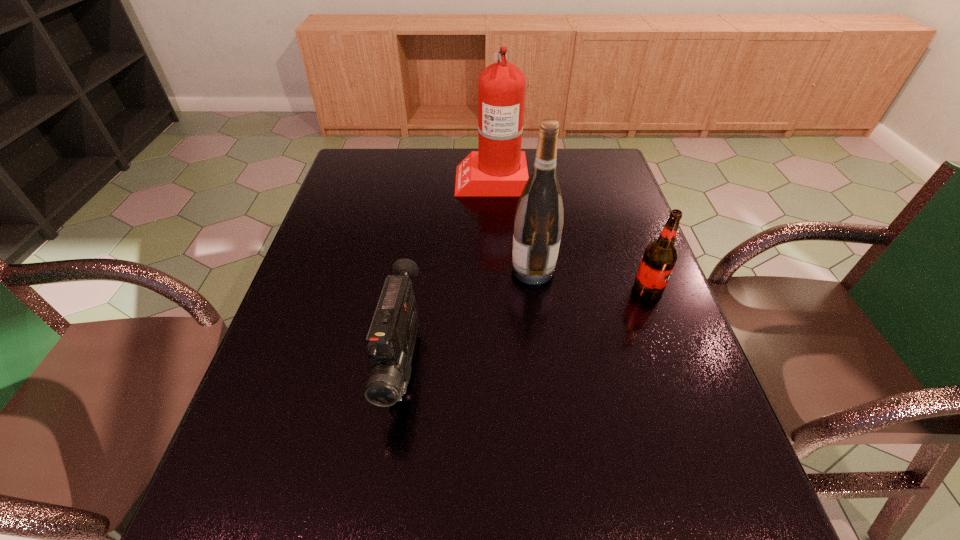
Where is `free space that satisfies the following two spatial constraints: 1. on the label of the wine bottle; 2. on the front-facing side of the nearest object`? free space that satisfies the following two spatial constraints: 1. on the label of the wine bottle; 2. on the front-facing side of the nearest object is located at coordinates (544, 364).

I want to click on vacant position in the image that satisfies the following two spatial constraints: 1. on the back side of the root beer; 2. on the label of the wine bottle, so click(x=640, y=270).